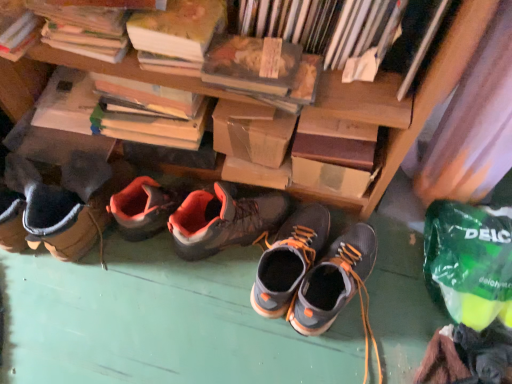
Where is `vacant space to the left of dark gray suede shoes at center, placed as the second footwear when sorted from left to right`? The width and height of the screenshot is (512, 384). vacant space to the left of dark gray suede shoes at center, placed as the second footwear when sorted from left to right is located at coordinates (214, 290).